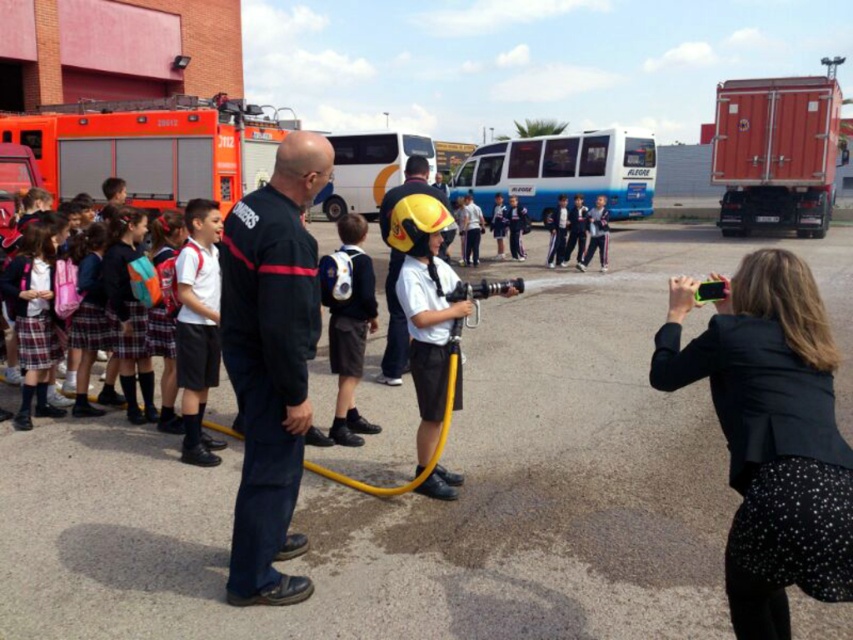
Question: Can you confirm if matte black backpack at center is smaller than yellow matte helmet at center?

Choices:
 (A) no
 (B) yes

Answer: (B)

Question: Which of the following is the closest to the observer?

Choices:
 (A) (292, 547)
 (B) (759, 547)

Answer: (B)

Question: Can you confirm if black uniform at center is smaller than yellow matte helmet at center?

Choices:
 (A) no
 (B) yes

Answer: (B)

Question: Does black textured blazer at lower right come behind matte black backpack at center?

Choices:
 (A) yes
 (B) no

Answer: (B)

Question: Which point is closer to the camera taking this photo?

Choices:
 (A) (395, 326)
 (B) (347, 252)

Answer: (B)

Question: Which point is closer to the camera?

Choices:
 (A) matte black backpack at center
 (B) black uniform at center
 (C) black textured blazer at lower right

Answer: (C)